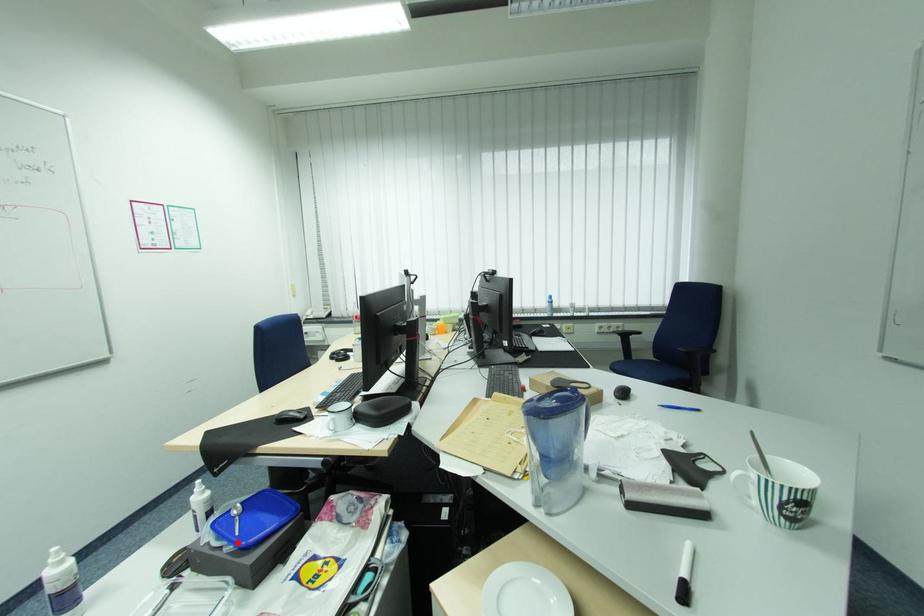
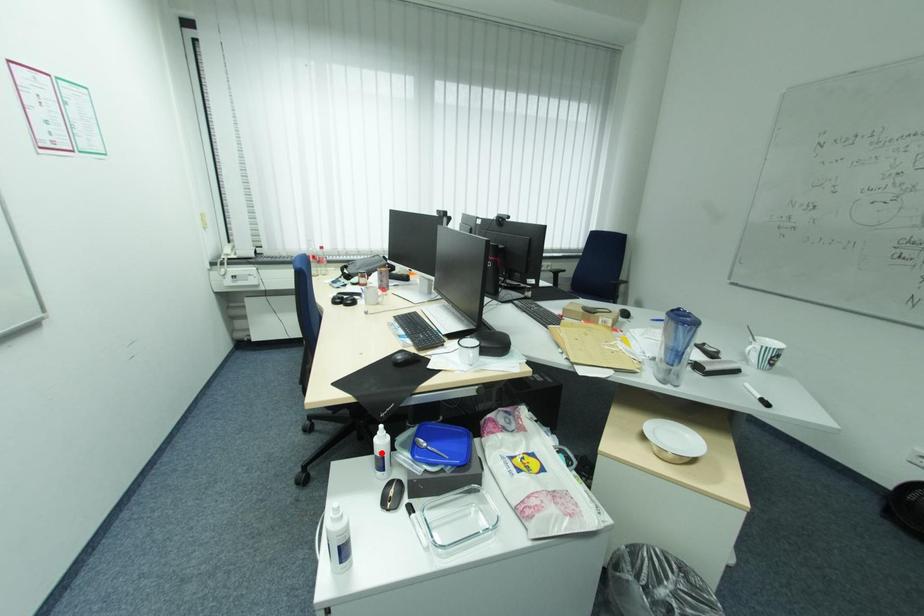
I am providing you with two images of the same scene from different viewpoints. A red point is marked on the first image and another point is marked on the second image. Does the point marked in image1 correspond to the same location as the one in image2?

No